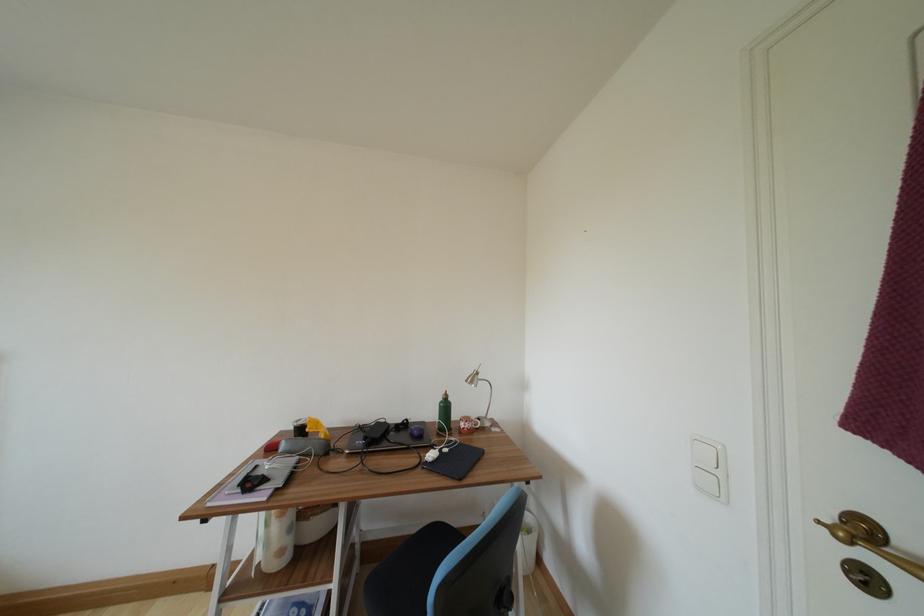
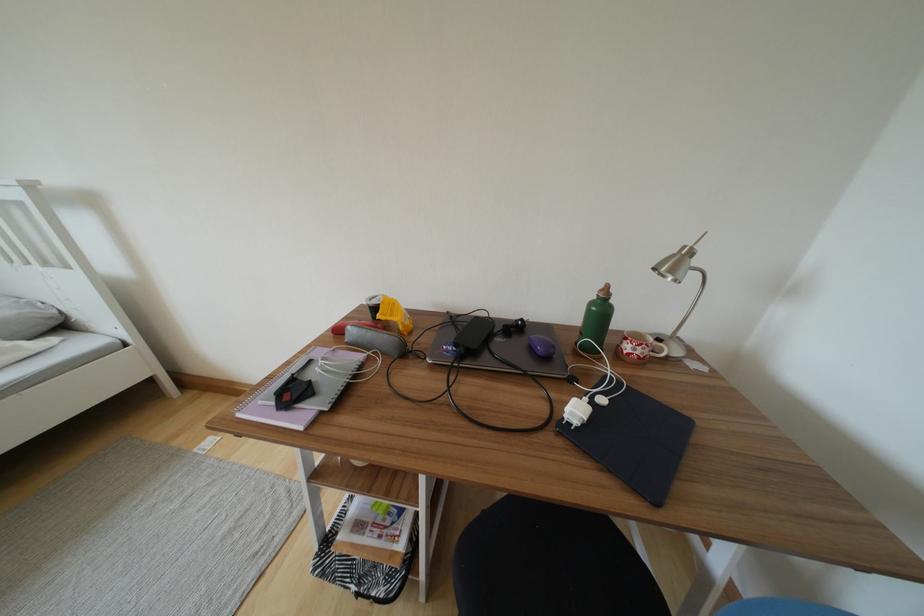
The first image is from the beginning of the video and the second image is from the end. How did the camera likely rotate when shooting the video?

The rotation direction of the camera is left-down.